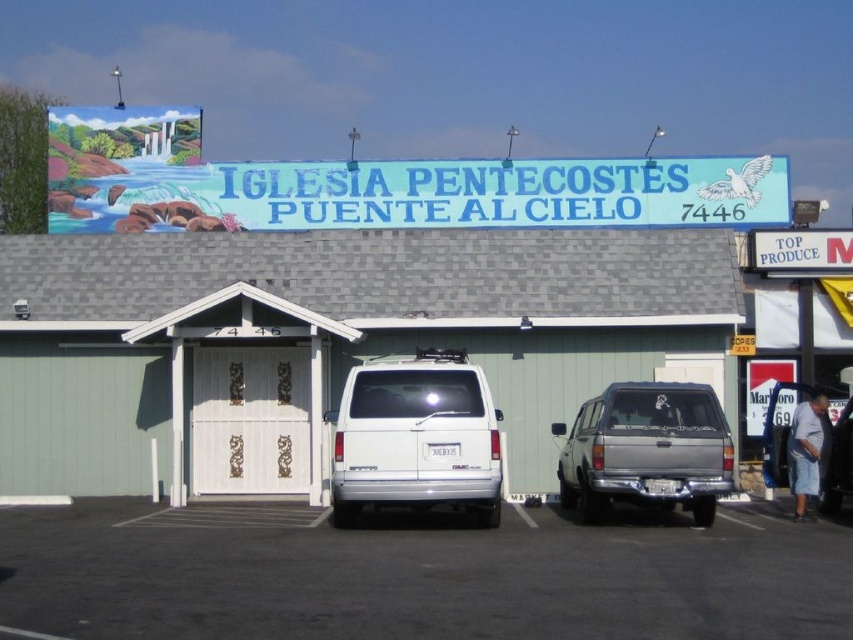
How far apart are silver metallic van at center and white plastic sign at upper right?

silver metallic van at center is 6.13 meters away from white plastic sign at upper right.

This screenshot has height=640, width=853. Identify the location of silver metallic van at center. (647, 451).

Is black asphalt parking lot at center smaller than white matte suv at center?

Result: Actually, black asphalt parking lot at center might be larger than white matte suv at center.

Which is below, black asphalt parking lot at center or white matte suv at center?

black asphalt parking lot at center is below.

Image resolution: width=853 pixels, height=640 pixels. What are the coordinates of `black asphalt parking lot at center` in the screenshot? It's located at (416, 577).

Which is above, white matte van at center or white plastic sign at upper right?

Positioned higher is white plastic sign at upper right.

Is white matte van at center to the left of white plastic sign at upper right from the viewer's perspective?

Yes, white matte van at center is to the left of white plastic sign at upper right.

Between point (103, 387) and point (845, 257), which one is positioned in front?

Positioned in front is point (103, 387).

At what (x,y) coordinates should I click in order to perform the action: click on white matte van at center. Please return your answer as a coordinate pair (x, y). This screenshot has height=640, width=853. Looking at the image, I should click on (328, 340).